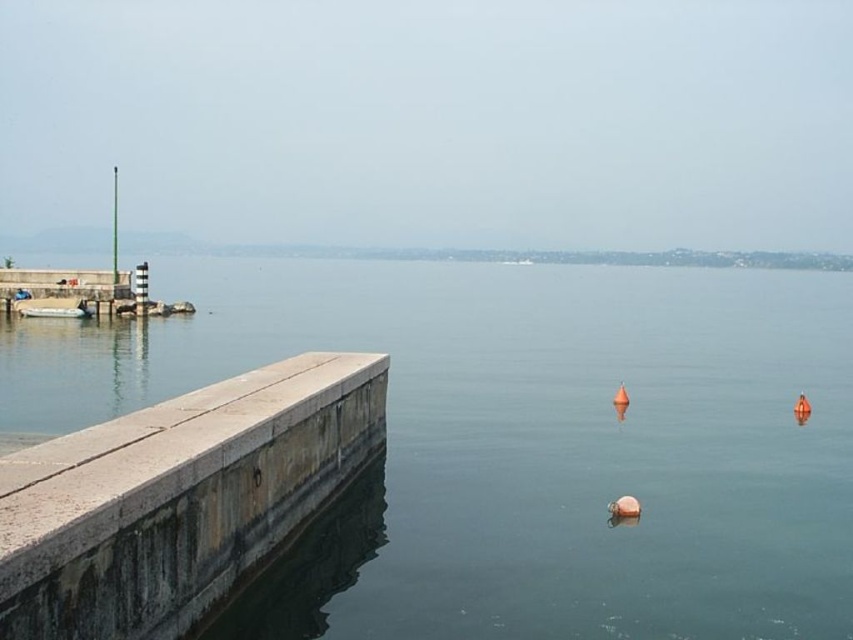
You are standing on the jetty and see the transparent water at center and the white rubber boat at left. Which object is higher in the image?

The transparent water at center is higher than the white rubber boat at left according to the description.

You are a painter planning to set up your easel on the concrete ledge at left to paint the white rubber boat at left. Considering the space available on the ledge, do you think your easel will fit comfortably?

The concrete ledge at left is narrower than the white rubber boat at left. Since the boat is wider, the ledge might not provide enough space for the easel to be placed comfortably.

You are standing on the concrete ledge at left and want to walk to the transparent water at center. Is the path directly in front of you clear of any obstacles?

The transparent water at center is positioned over the concrete ledge at left, so the path directly in front of you is clear as the water is above the ledge.